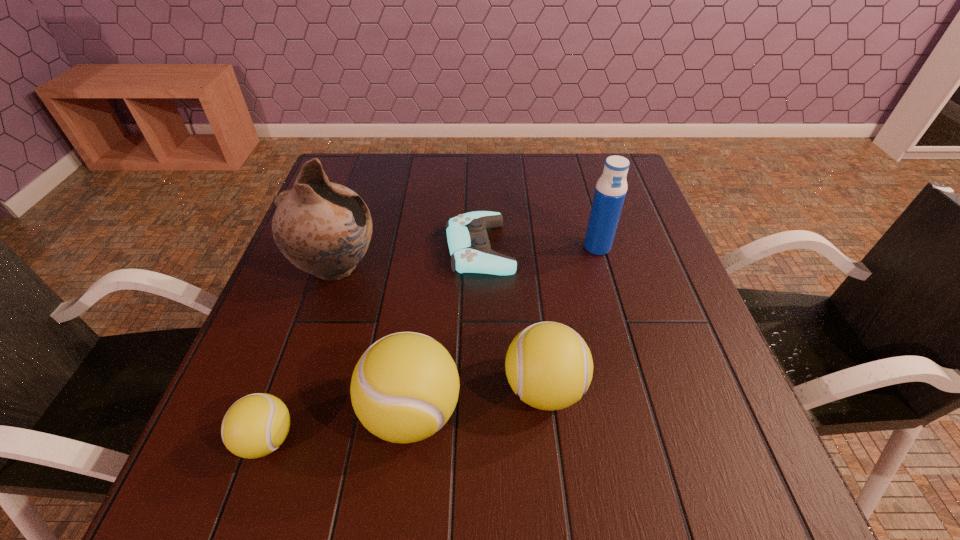
Please point a spot to add another tennis ball on the right. Please provide its 2D coordinates. Your answer should be formatted as a tuple, i.e. [(x, y)], where the tuple contains the x and y coordinates of a point satisfying the conditions above.

[(666, 366)]